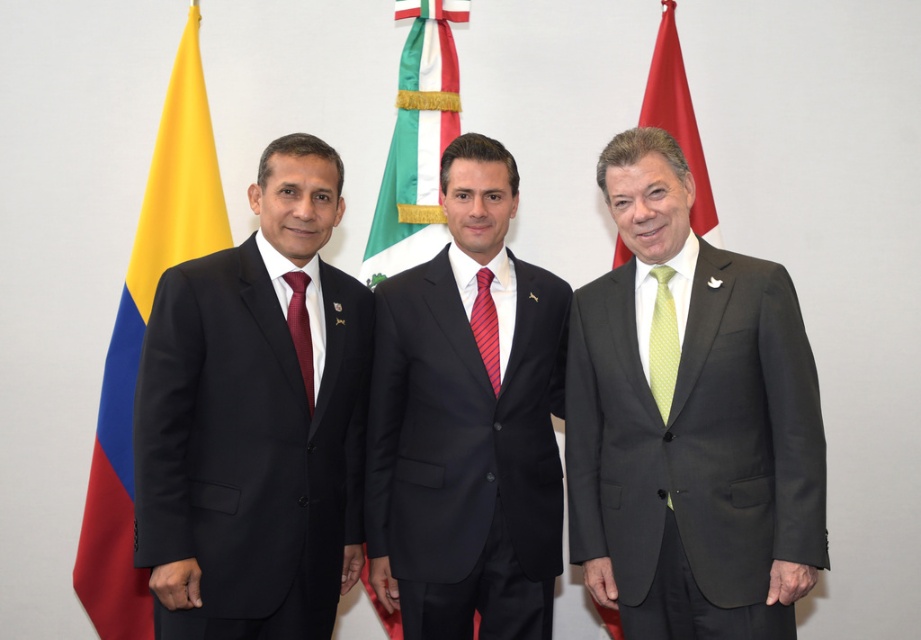
In the scene shown: You are a photographer setting up a shot of the three men and flags. You need to ensure the red fabric flag at right and the light green dotted tie at right are both visible in the frame. Which one should you focus on to make sure it stands out more due to its size?

The red fabric flag at right is bigger than the light green dotted tie at right, so focusing on the red fabric flag at right will make it stand out more due to its larger size.

You are a photographer adjusting your camera to focus on two specific points in the image. The first point is at coordinate point [117,579] and the second is at point [492,384]. Which point should you focus on first if you want to start with the closest one to the camera?

Point [117,579] is further to the viewer than point [492,384], so you should focus on point [117,579] first as it is closer to the camera.